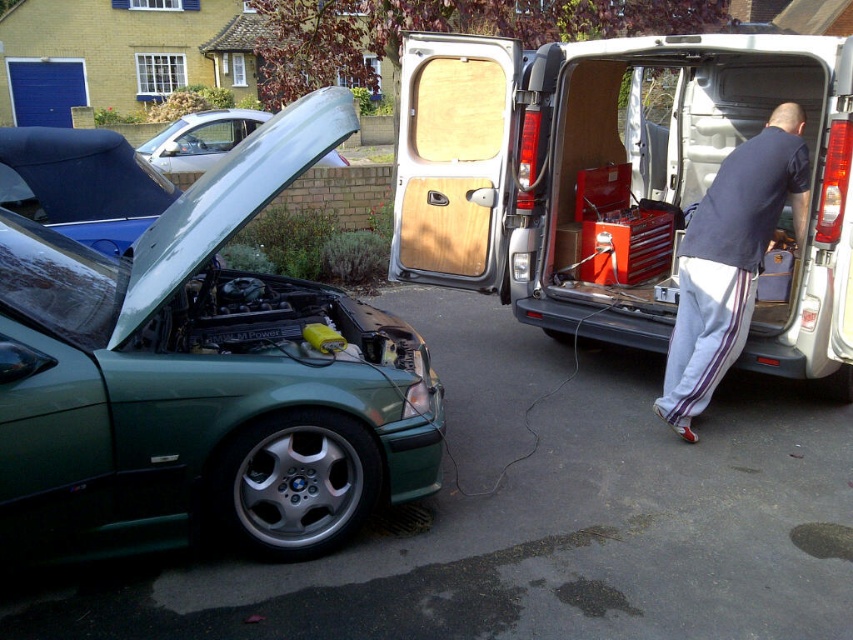
Can you confirm if silver metallic van at right is thinner than silver metallic car at upper left?

Indeed, silver metallic van at right has a lesser width compared to silver metallic car at upper left.

Is silver metallic van at right shorter than silver metallic car at upper left?

Yes, silver metallic van at right is shorter than silver metallic car at upper left.

Find the location of a particular element. silver metallic van at right is located at coordinates (618, 182).

Can you confirm if green metallic car at left is positioned to the left of silver metallic van at right?

Indeed, green metallic car at left is positioned on the left side of silver metallic van at right.

Is point (128, 252) positioned behind point (817, 291)?

Yes.

Where is `green metallic car at left`? The height and width of the screenshot is (640, 853). green metallic car at left is located at coordinates (202, 380).

Is green metallic car at left to the right of dark blue t-shirt at center from the viewer's perspective?

In fact, green metallic car at left is to the left of dark blue t-shirt at center.

Can you confirm if green metallic car at left is positioned above dark blue t-shirt at center?

Actually, green metallic car at left is below dark blue t-shirt at center.

Find the location of a particular element. The image size is (853, 640). green metallic car at left is located at coordinates (202, 380).